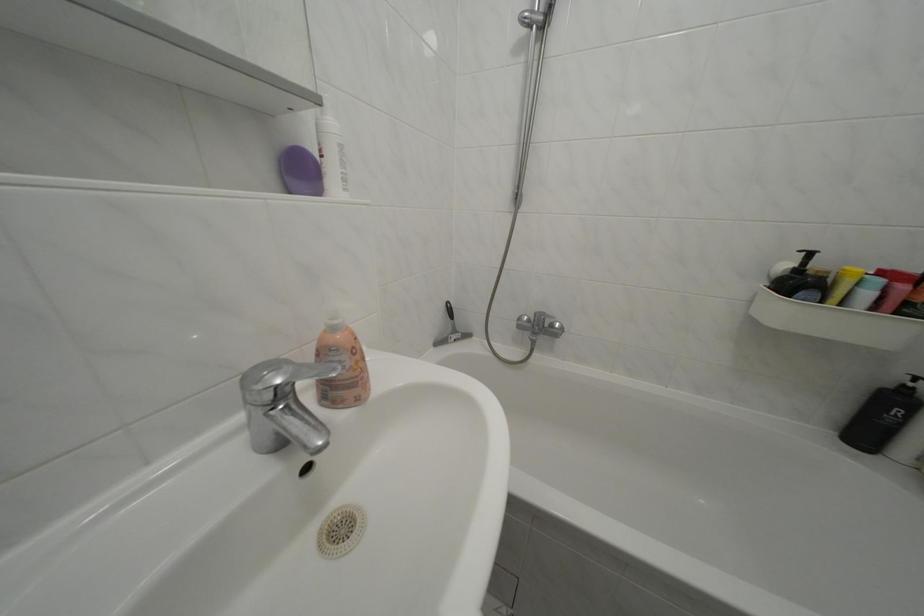
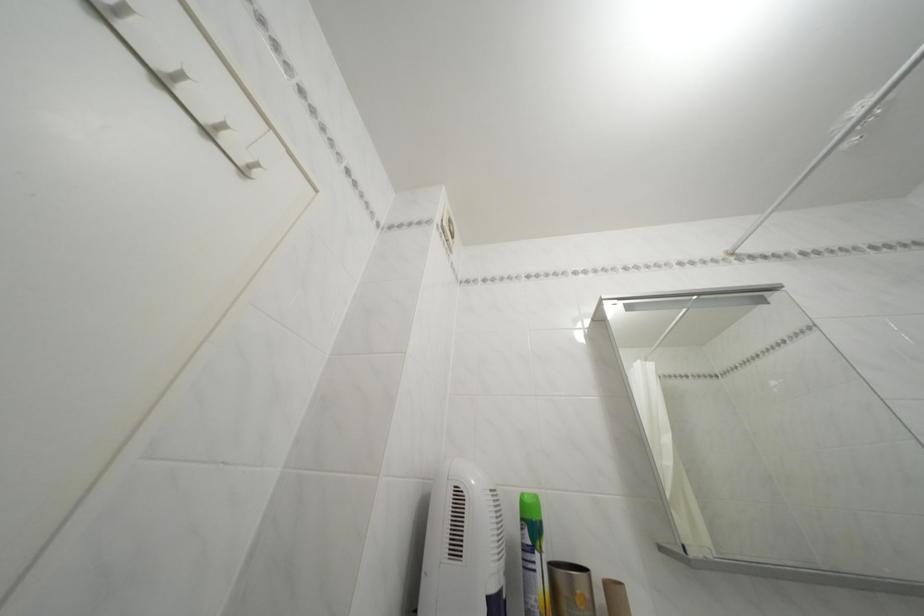
Based on the continuous images, in which direction is the camera rotating?

The camera rotated toward left-up.